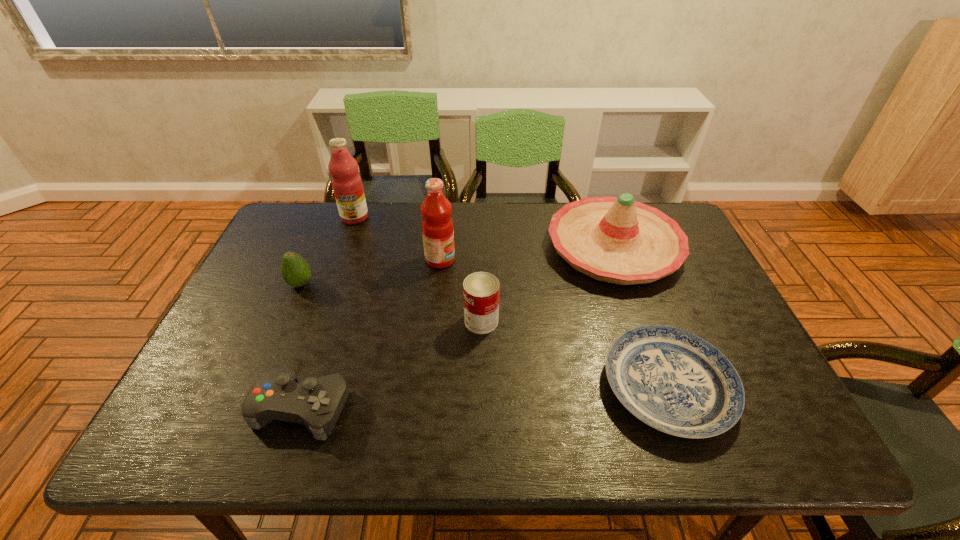
Where is `free spot at the right edge of the desktop`? free spot at the right edge of the desktop is located at coordinates (769, 399).

The image size is (960, 540). What are the coordinates of `vacant space in between the third nearest object and the second shortest object` in the screenshot? It's located at (392, 364).

The width and height of the screenshot is (960, 540). I want to click on unoccupied area between the farther fruit juice and the can, so click(x=418, y=269).

This screenshot has width=960, height=540. Find the location of `empty space that is in between the fifth tallest object and the fifth farthest object`. empty space that is in between the fifth tallest object and the fifth farthest object is located at coordinates (391, 302).

Where is `vacant space that's between the avocado and the control`? The width and height of the screenshot is (960, 540). vacant space that's between the avocado and the control is located at coordinates (301, 346).

Identify the location of free space between the control and the farther fruit juice. (328, 313).

I want to click on free spot between the avocado and the can, so click(391, 302).

What are the coordinates of `free space between the fifth shortest object and the fifth tallest object` in the screenshot? It's located at (457, 265).

I want to click on vacant space that's between the left fruit juice and the shortest object, so click(x=512, y=302).

The width and height of the screenshot is (960, 540). Find the location of `free point between the fifth farthest object and the second shortest object`. free point between the fifth farthest object and the second shortest object is located at coordinates (392, 364).